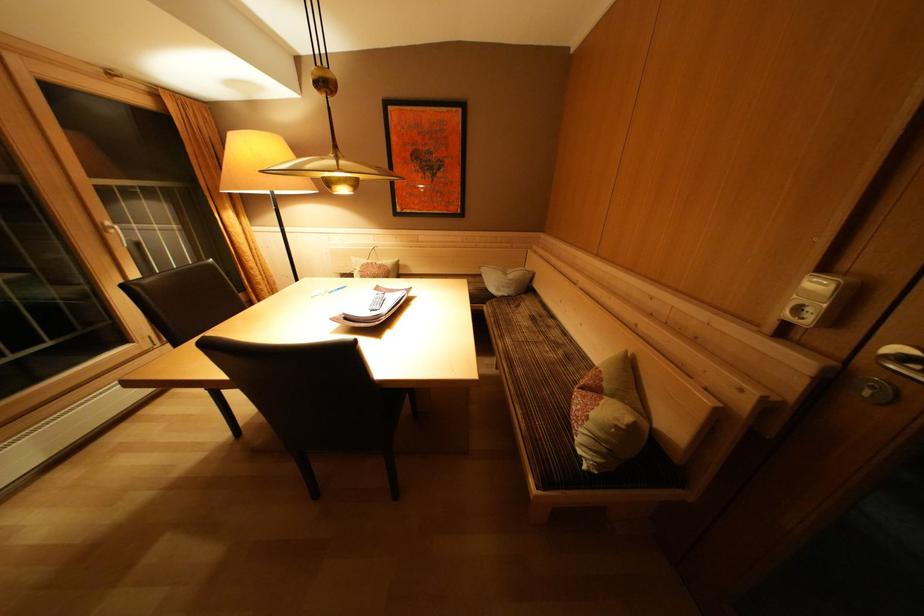
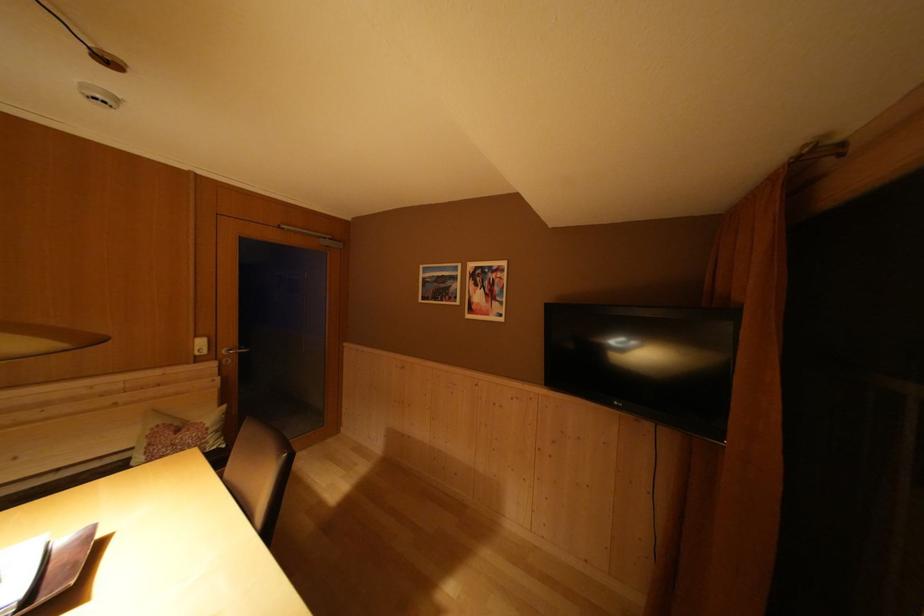
Find the pixel in the second image that matches [835,389] in the first image.

(226, 371)